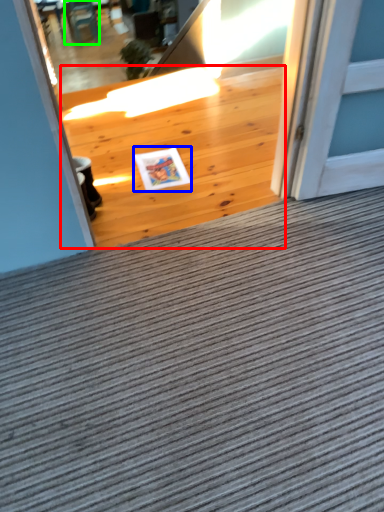
Question: Which object is positioned farthest from hardwood (highlighted by a red box)? Select from postcard (highlighted by a blue box) and chair (highlighted by a green box).

Choices:
 (A) postcard
 (B) chair

Answer: (B)